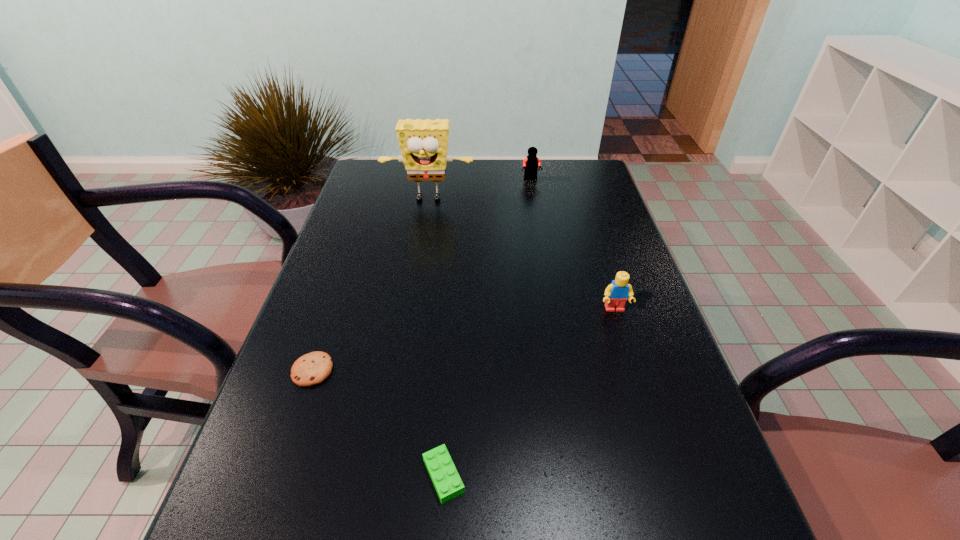
Where is `vacant area situated on the front-facing side of the sponge`? Image resolution: width=960 pixels, height=540 pixels. vacant area situated on the front-facing side of the sponge is located at coordinates pyautogui.click(x=417, y=271).

I want to click on vacant space located on the front-facing side of the farthest object, so click(x=533, y=191).

Identify the location of free region located 0.320m on the front-facing side of the rightmost object. (659, 451).

Where is `vacant space located on the back of the leftmost Lego`? This screenshot has width=960, height=540. vacant space located on the back of the leftmost Lego is located at coordinates (450, 365).

You are a GUI agent. You are given a task and a screenshot of the screen. Output one action in this format:
    pyautogui.click(x=<x>, y=<y>)
    Task: Click on the vacant space situated 0.400m on the right of the shortest object
    This screenshot has height=540, width=960.
    Given the screenshot: What is the action you would take?
    pyautogui.click(x=531, y=370)

Locate an element on the screen. The width and height of the screenshot is (960, 540). sponge located in the far edge section of the desktop is located at coordinates (423, 143).

Image resolution: width=960 pixels, height=540 pixels. What are the coordinates of `Lego at the far edge` in the screenshot? It's located at (532, 162).

At what (x,y) coordinates should I click in order to perform the action: click on sponge at the left edge. Please return your answer as a coordinate pair (x, y). Image resolution: width=960 pixels, height=540 pixels. Looking at the image, I should click on (423, 143).

You are a GUI agent. You are given a task and a screenshot of the screen. Output one action in this format:
    pyautogui.click(x=<x>, y=<y>)
    Task: Click on the cookie positioned at the left edge
    The width and height of the screenshot is (960, 540).
    Given the screenshot: What is the action you would take?
    pyautogui.click(x=313, y=368)

Identify the location of object positioned at the right edge. (616, 294).